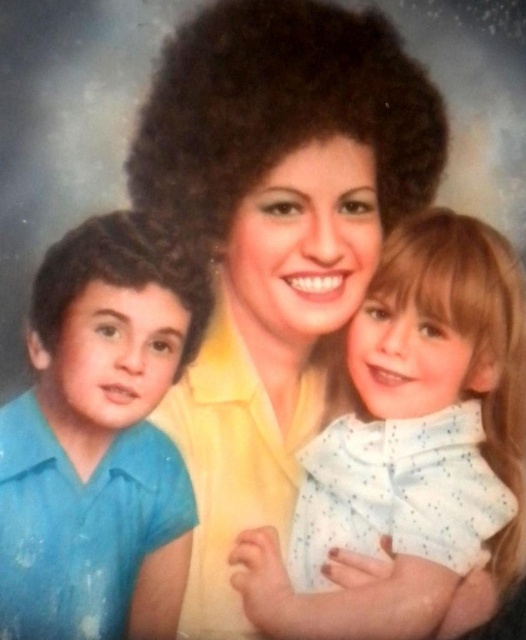
At what (x,y) coordinates should I click in order to perform the action: click on yellow matte shirt at center. Please return your answer as a coordinate pair (x, y). Image resolution: width=526 pixels, height=640 pixels. Looking at the image, I should click on (275, 237).

Is point (185, 442) in front of point (173, 353)?

No, it is not.

Between point (247, 470) and point (94, 412), which one is positioned in front?

Point (94, 412)

In order to click on yellow matte shirt at center in this screenshot , I will do `click(275, 237)`.

Does white dotted shirt at center have a greater width compared to blue cotton shirt at left?

Yes.

This screenshot has height=640, width=526. Find the location of `white dotted shirt at center`. white dotted shirt at center is located at coordinates (409, 448).

Which is behind, point (409, 397) or point (59, 460)?

The point (409, 397) is more distant.

At what (x,y) coordinates should I click in order to perform the action: click on white dotted shirt at center. Please return your answer as a coordinate pair (x, y). The image size is (526, 640). Looking at the image, I should click on (409, 448).

Is yellow matte shirt at center smaller than white dotted shirt at center?

No, yellow matte shirt at center is not smaller than white dotted shirt at center.

You are a GUI agent. You are given a task and a screenshot of the screen. Output one action in this format:
    pyautogui.click(x=<x>, y=<y>)
    Task: Click on the yellow matte shirt at center
    
    Given the screenshot: What is the action you would take?
    pyautogui.click(x=275, y=237)